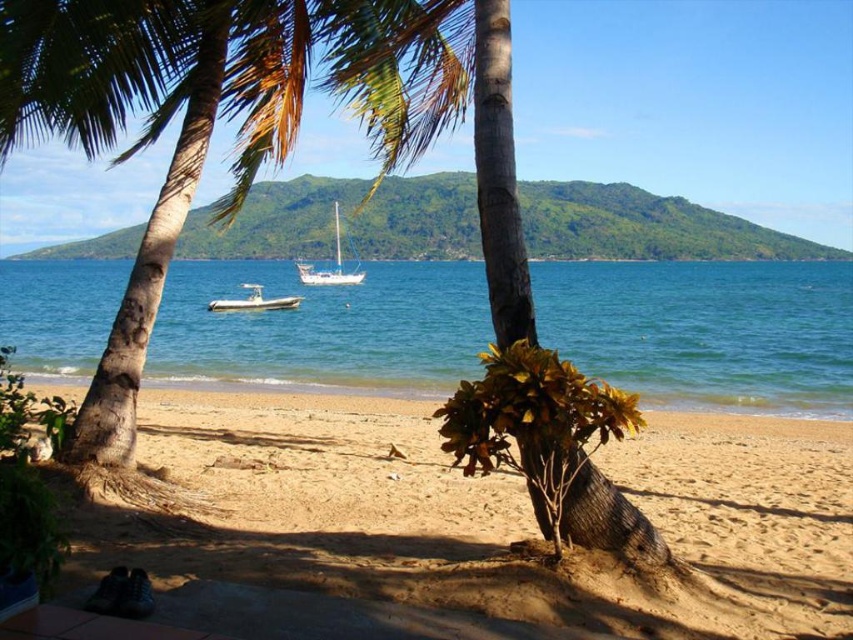
You are standing on the sandy beach at lower center and want to walk to the green leafy palm tree at center. Which direction should you move to reach the tree?

You should move backward because the sandy beach at lower center is in front of the green leafy palm tree at center, meaning the tree is behind you.

You are a photographer planning to capture the clear blue water at center and the white matte boat at center in a single shot. Based on their relative heights, which object will appear taller in your photo?

The clear blue water at center will appear taller in the photo because it has a greater height compared to the white matte boat at center.